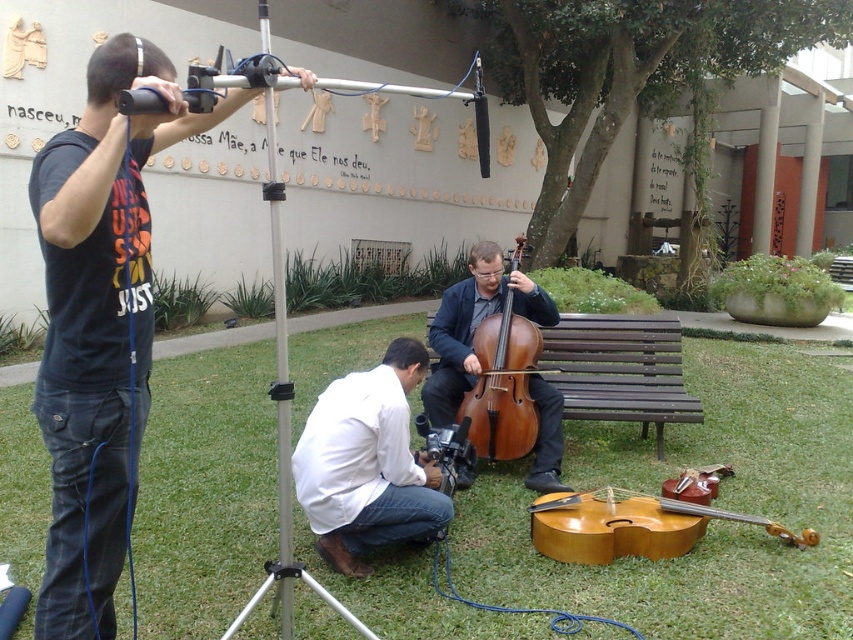
Based on the scene description, where is the brown wooden bench at center in relation to the light brown wooden violin at lower center?

The brown wooden bench at center is to the left of the light brown wooden violin at lower center.